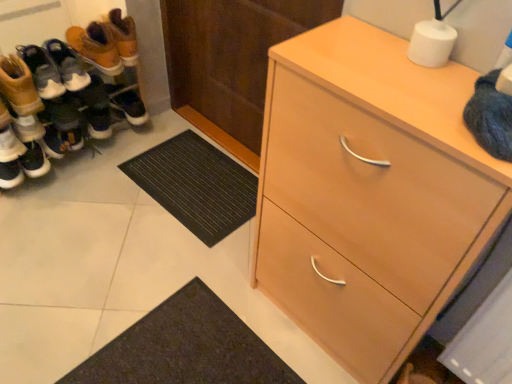
Question: Is wooden door at center facing away from black rubber doormat at lower center?

Choices:
 (A) no
 (B) yes

Answer: (A)

Question: Is the depth of wooden door at center less than that of black rubber doormat at lower center?

Choices:
 (A) yes
 (B) no

Answer: (A)

Question: Does wooden door at center have a greater height compared to black rubber doormat at lower center?

Choices:
 (A) yes
 (B) no

Answer: (A)

Question: Is wooden door at center outside of black rubber doormat at lower center?

Choices:
 (A) yes
 (B) no

Answer: (A)

Question: Does wooden door at center have a greater width compared to black rubber doormat at lower center?

Choices:
 (A) no
 (B) yes

Answer: (A)

Question: From a real-world perspective, is black rubber doormat at lower center above or below leather boots at left, the third footwear when ordered from back to front?

Choices:
 (A) above
 (B) below

Answer: (B)

Question: In the image, is black rubber doormat at lower center on the left side or the right side of leather boots at left, the second footwear viewed from the front?

Choices:
 (A) left
 (B) right

Answer: (B)

Question: Is black rubber doormat at lower center in front of or behind leather boots at left, the second footwear viewed from the front, in the image?

Choices:
 (A) behind
 (B) front

Answer: (A)

Question: Considering the positions of black rubber doormat at lower center and leather boots at left, the third footwear when ordered from back to front, in the image, is black rubber doormat at lower center taller or shorter than leather boots at left, the third footwear when ordered from back to front,?

Choices:
 (A) short
 (B) tall

Answer: (A)

Question: From the image's perspective, is leather boots at left, which is counted as the fourth footwear, starting from the back, located above or below wooden door at center?

Choices:
 (A) below
 (B) above

Answer: (A)

Question: Considering the positions of leather boots at left, the first footwear positioned from the front, and wooden door at center in the image, is leather boots at left, the first footwear positioned from the front, bigger or smaller than wooden door at center?

Choices:
 (A) big
 (B) small

Answer: (B)

Question: In the image, is leather boots at left, which is counted as the fourth footwear, starting from the back, positioned in front of or behind wooden door at center?

Choices:
 (A) front
 (B) behind

Answer: (B)

Question: In terms of height, does leather boots at left, which is counted as the fourth footwear, starting from the back, look taller or shorter compared to wooden door at center?

Choices:
 (A) tall
 (B) short

Answer: (B)

Question: From a real-world perspective, relative to leather boots at left, the third footwear when ordered from back to front, is wooden door at center vertically above or below?

Choices:
 (A) below
 (B) above

Answer: (B)

Question: Looking at their shapes, would you say wooden door at center is wider or thinner than leather boots at left, the third footwear when ordered from back to front?

Choices:
 (A) thin
 (B) wide

Answer: (A)